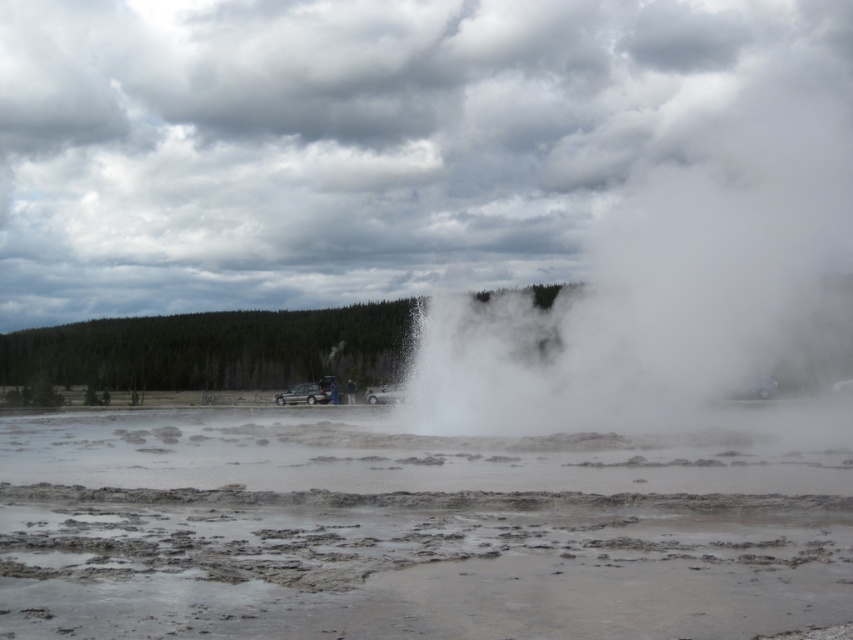
Question: Does muddy water at center appear on the left side of white vapor at center?

Choices:
 (A) yes
 (B) no

Answer: (A)

Question: Where is muddy water at center located in relation to white vapor at center in the image?

Choices:
 (A) right
 (B) left

Answer: (B)

Question: Which of the following is the closest to the observer?

Choices:
 (A) click(x=817, y=333)
 (B) click(x=363, y=461)

Answer: (B)

Question: Which point is farther to the camera?

Choices:
 (A) muddy water at center
 (B) white vapor at center

Answer: (B)

Question: Is muddy water at center positioned in front of white vapor at center?

Choices:
 (A) yes
 (B) no

Answer: (A)